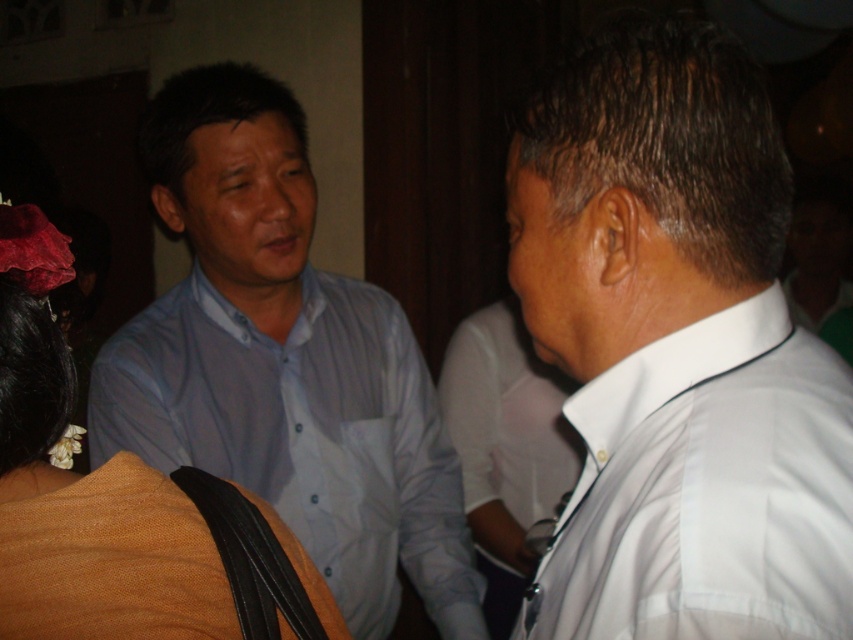
Question: Which point appears farthest from the camera in this image?

Choices:
 (A) (231, 525)
 (B) (627, 243)
 (C) (225, 317)

Answer: (C)

Question: Considering the real-world distances, which object is closest to the matte orange fabric at lower left?

Choices:
 (A) blue button-down shirt at center
 (B) white smooth shirt at right

Answer: (B)

Question: Does white smooth shirt at right appear on the left side of matte orange fabric at lower left?

Choices:
 (A) no
 (B) yes

Answer: (A)

Question: Which of the following is the closest to the observer?

Choices:
 (A) white smooth shirt at right
 (B) matte orange fabric at lower left
 (C) blue button-down shirt at center

Answer: (A)

Question: Does white smooth shirt at right have a smaller size compared to matte orange fabric at lower left?

Choices:
 (A) yes
 (B) no

Answer: (B)

Question: Is white smooth shirt at right above blue button-down shirt at center?

Choices:
 (A) no
 (B) yes

Answer: (B)